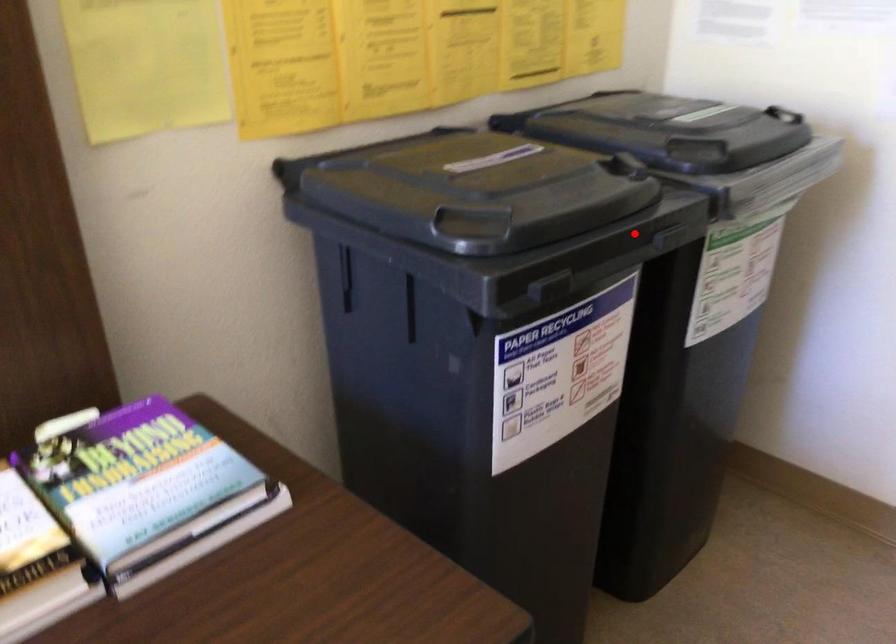
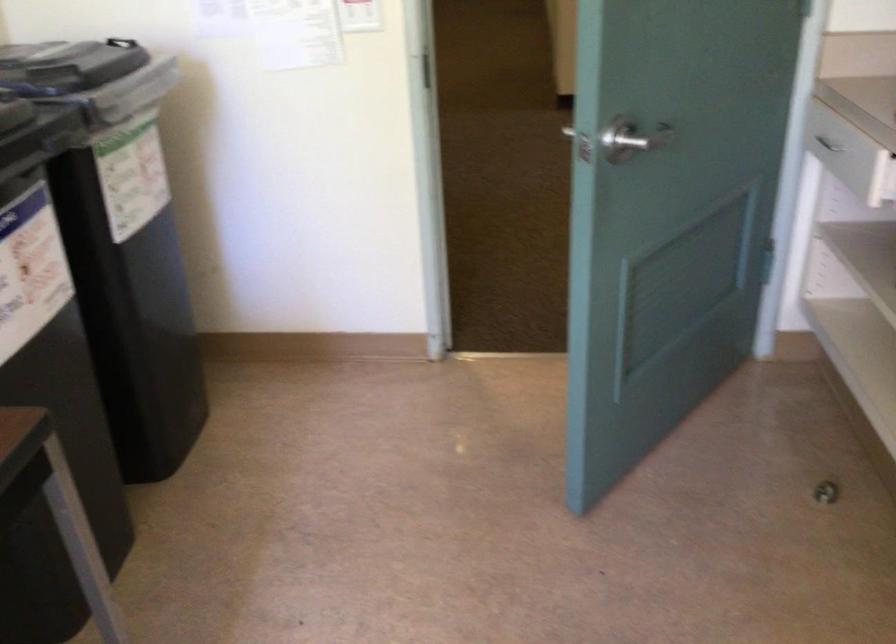
Question: I am providing you with two images of the same scene from different viewpoints. In image1, a red point is highlighted. Considering the same 3D point in image2, which of the following is correct?

Choices:
 (A) It is closer
 (B) It is farther

Answer: (B)